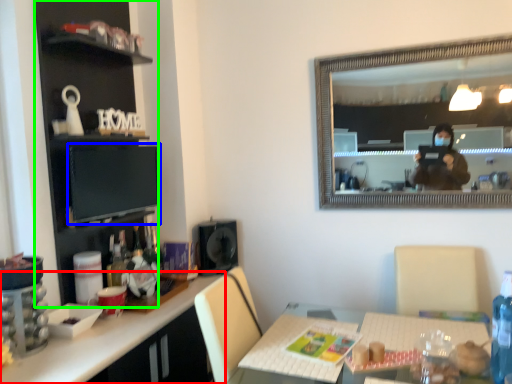
Question: Which object is positioned closest to desk (highlighted by a red box)? Select from computer monitor (highlighted by a blue box) and cabinetry (highlighted by a green box).

Choices:
 (A) computer monitor
 (B) cabinetry

Answer: (A)